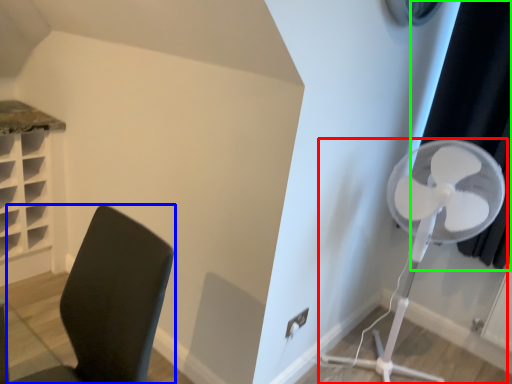
Question: Considering the real-world distances, which object is farthest from mechanical fan (highlighted by a red box)? furniture (highlighted by a blue box) or curtain (highlighted by a green box)?

Choices:
 (A) furniture
 (B) curtain

Answer: (A)